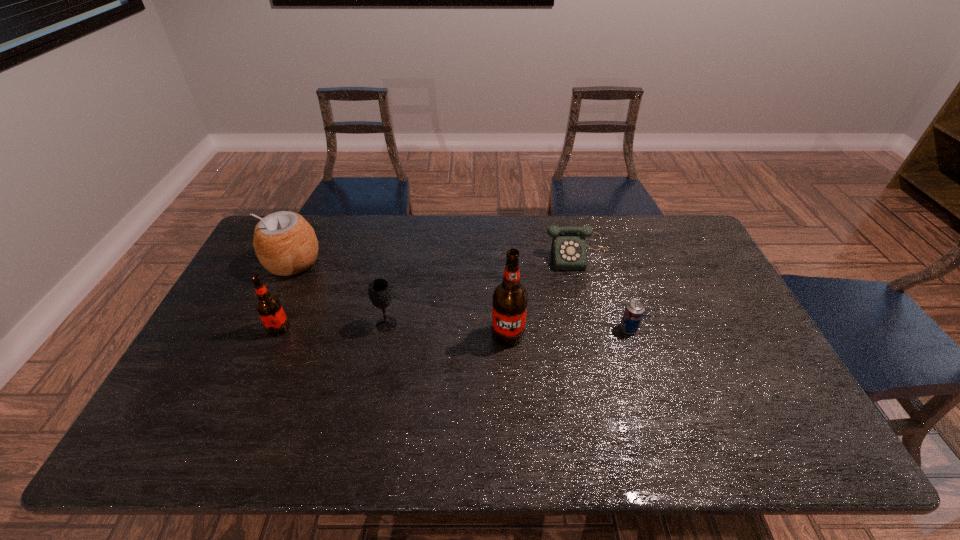
The root beers are evenly distributed in the image. To maintain this, where would you place another root beer on the right? Please point to a free space. Please provide its 2D coordinates. Your answer should be formatted as a tuple, i.e. [(x, y)], where the tuple contains the x and y coordinates of a point satisfying the conditions above.

[(743, 341)]